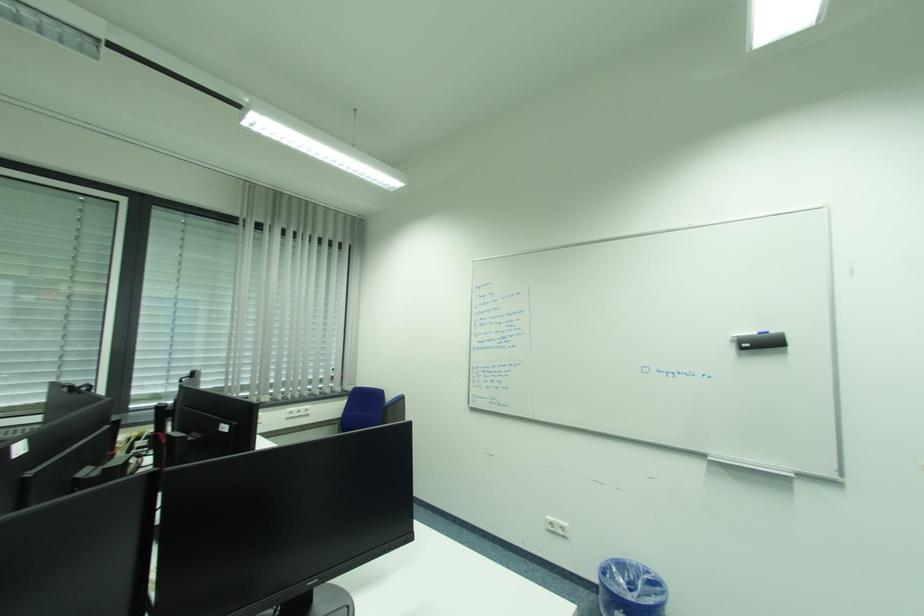
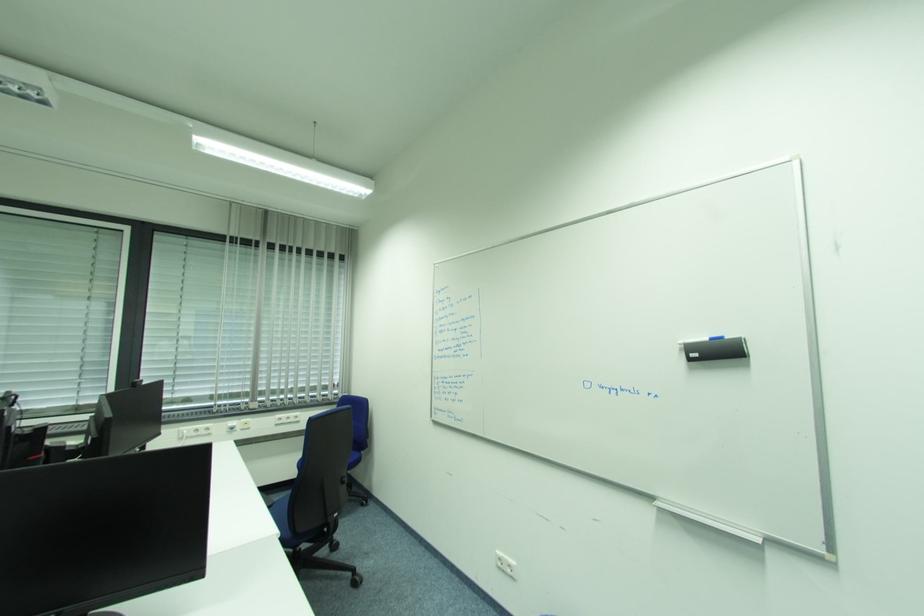
Question: The images are taken continuously from a first-person perspective. In which direction is your viewpoint rotating?

Choices:
 (A) Left
 (B) Right
 (C) Up
 (D) Down

Answer: (A)